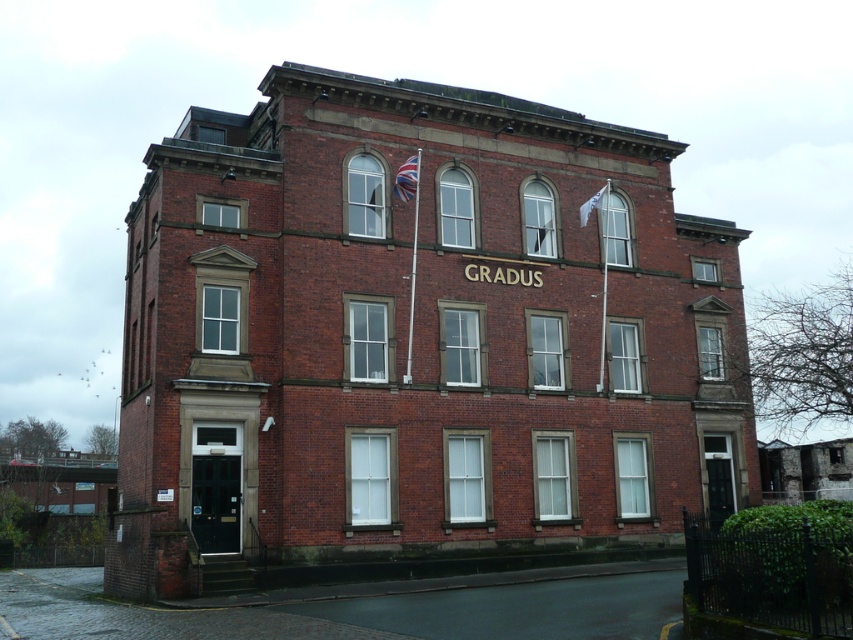
You are standing in front of the three story brick building and see two flags. The union jack fabric flag at upper center and the white fabric flag at upper right. Which flag is bigger?

The union jack fabric flag at upper center is larger in size than the white fabric flag at upper right.

You are a visitor standing in front of the building and want to compare the flags. Which flag is wider between the union jack fabric flag at upper center and the white fabric flag at upper right?

The union jack fabric flag at upper center is wider than the white fabric flag at upper right according to their widths.